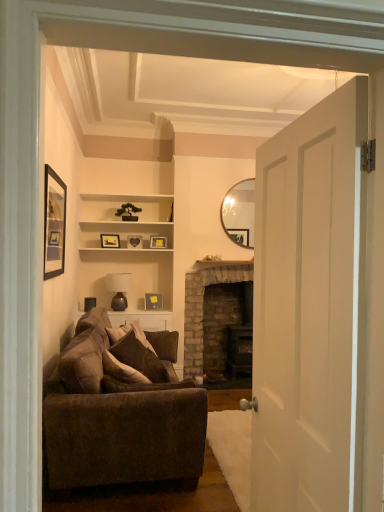
Question: Does matte brown lamp at center have a larger size compared to black matte picture frame at upper left, acting as the 1th picture frame starting from the front?

Choices:
 (A) no
 (B) yes

Answer: (B)

Question: Is matte brown lamp at center touching black matte picture frame at upper left, the fifth picture frame in the bottom-to-top sequence?

Choices:
 (A) yes
 (B) no

Answer: (B)

Question: Does matte brown lamp at center have a lesser height compared to black matte picture frame at upper left, which is counted as the fifth picture frame, starting from the back?

Choices:
 (A) no
 (B) yes

Answer: (B)

Question: Could you tell me if matte brown lamp at center is turned towards black matte picture frame at upper left, which is counted as the fifth picture frame, starting from the back?

Choices:
 (A) yes
 (B) no

Answer: (A)

Question: Are matte brown lamp at center and black matte picture frame at upper left, positioned as the 1th picture frame in top-to-bottom order, located far from each other?

Choices:
 (A) no
 (B) yes

Answer: (B)

Question: Is matte yellow picture frame at center, which is counted as the second picture frame, starting from the bottom, to the left or to the right of matte gold picture frame at upper center, the 1th picture frame when ordered from bottom to top, in the image?

Choices:
 (A) left
 (B) right

Answer: (B)

Question: Is matte yellow picture frame at center, the 4th picture frame from the front, taller or shorter than matte gold picture frame at upper center, marked as the 5th picture frame in a front-to-back arrangement?

Choices:
 (A) tall
 (B) short

Answer: (B)

Question: From a real-world perspective, is matte yellow picture frame at center, the 4th picture frame from the front, physically located above or below matte gold picture frame at upper center, the 5th picture frame viewed from the top?

Choices:
 (A) above
 (B) below

Answer: (A)

Question: Is matte yellow picture frame at center, the 2th picture frame when ordered from back to front, wider or thinner than matte gold picture frame at upper center, the 1th picture frame when ordered from bottom to top?

Choices:
 (A) thin
 (B) wide

Answer: (A)

Question: Does point (157, 296) appear closer or farther from the camera than point (135, 238)?

Choices:
 (A) farther
 (B) closer

Answer: (A)

Question: Do you think matte gold picture frame at upper center, the 1th picture frame when ordered from bottom to top, is within wooden heart at center, the third picture frame positioned from the back, or outside of it?

Choices:
 (A) outside
 (B) inside

Answer: (A)

Question: Is matte gold picture frame at upper center, the 1th picture frame when ordered from bottom to top, taller or shorter than wooden heart at center, the third picture frame positioned from the back?

Choices:
 (A) short
 (B) tall

Answer: (B)

Question: In terms of size, does matte gold picture frame at upper center, the 1th picture frame when ordered from bottom to top, appear bigger or smaller than wooden heart at center, which is the 3th picture frame in front-to-back order?

Choices:
 (A) small
 (B) big

Answer: (B)

Question: Does point (147, 309) appear closer or farther from the camera than point (107, 242)?

Choices:
 (A) farther
 (B) closer

Answer: (A)

Question: Considering their positions, is matte gold picture frame at upper center, the 1th picture frame when ordered from bottom to top, located in front of or behind matte black picture frame at upper center, which appears as the 2th picture frame when viewed from the front?

Choices:
 (A) behind
 (B) front

Answer: (A)